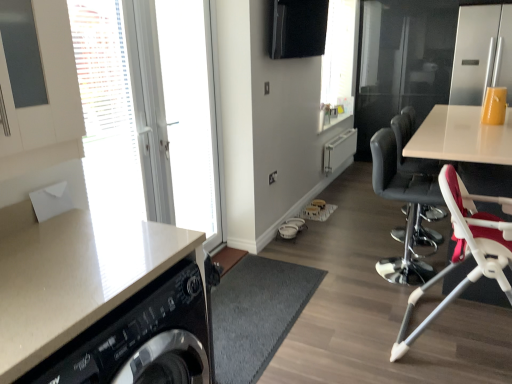
Where is `free space between red fabric high chair at right, positioned as the second chair in back-to-front order, and white glossy door at left, which is counted as the first window, starting from the back`? free space between red fabric high chair at right, positioned as the second chair in back-to-front order, and white glossy door at left, which is counted as the first window, starting from the back is located at coordinates (308, 312).